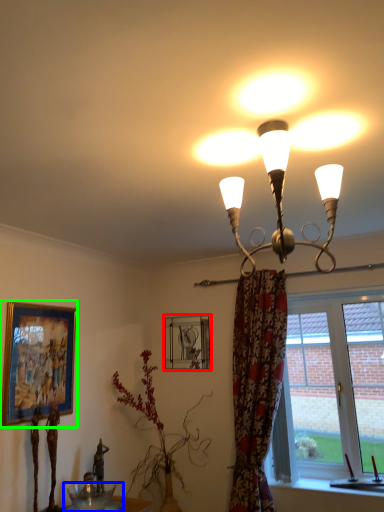
Question: Which object is positioned closest to picture frame (highlighted by a red box)? Select from glass table (highlighted by a blue box) and picture frame (highlighted by a green box).

Choices:
 (A) glass table
 (B) picture frame

Answer: (B)